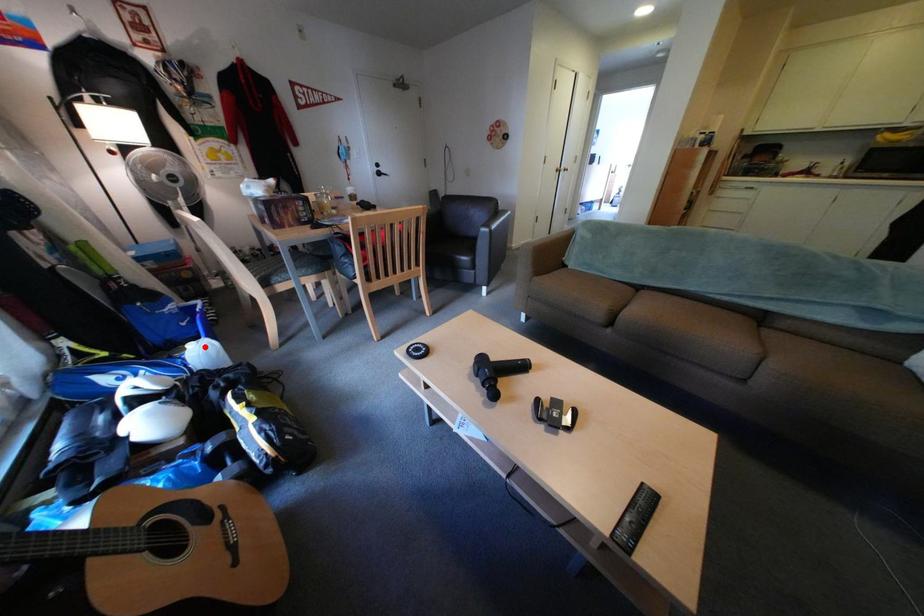
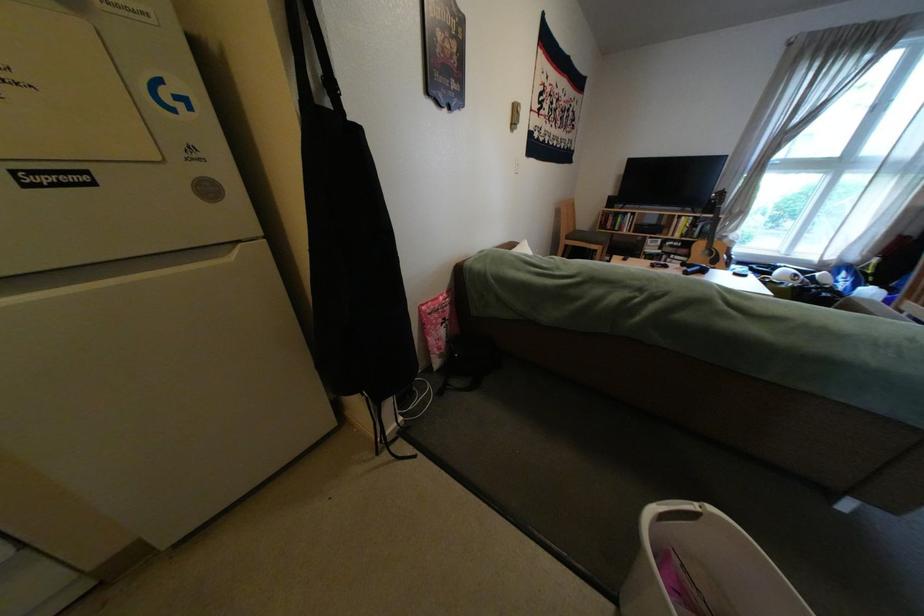
Question: I am providing you with two images of the same scene from different viewpoints. A red point is marked on the first image. At the location where the point appears in image 1, is it still visible in image 2?

Choices:
 (A) Yes
 (B) No

Answer: (B)